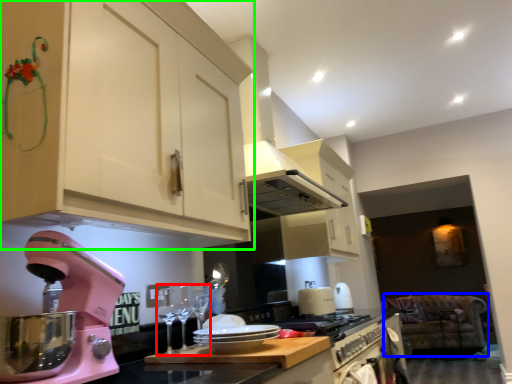
Question: Estimate the real-world distances between objects in this image. Which object is farther from wine glass (highlighted by a red box), sit (highlighted by a blue box) or cabinetry (highlighted by a green box)?

Choices:
 (A) sit
 (B) cabinetry

Answer: (A)